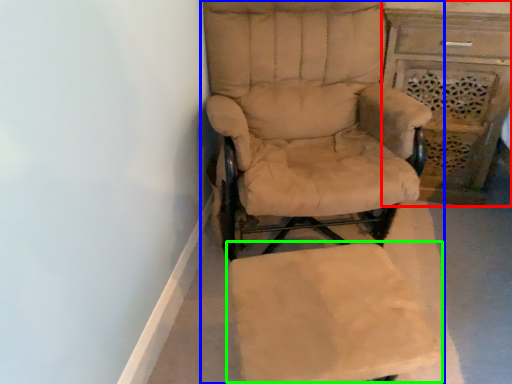
Question: Which object is positioned closest to vanity (highlighted by a red box)? Select from chair (highlighted by a blue box) and swivel chair (highlighted by a green box).

Choices:
 (A) chair
 (B) swivel chair

Answer: (A)